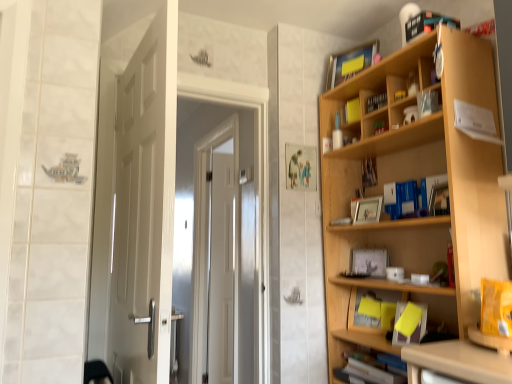
Question: Is the position of matte yellow book at upper right, the second book viewed from the top, less distant than that of yellow paper at lower right, the ninth book from the top?

Choices:
 (A) yes
 (B) no

Answer: (B)

Question: Is matte yellow book at upper right, positioned as the 9th book in bottom-to-top order, oriented towards yellow paper at lower right, which is the 2th book from bottom to top?

Choices:
 (A) no
 (B) yes

Answer: (A)

Question: Can you confirm if matte yellow book at upper right, positioned as the 9th book in bottom-to-top order, is smaller than yellow paper at lower right, the ninth book from the top?

Choices:
 (A) yes
 (B) no

Answer: (B)

Question: Is matte yellow book at upper right, the second book viewed from the top, further to the viewer compared to yellow paper at lower right, the ninth book from the top?

Choices:
 (A) yes
 (B) no

Answer: (A)

Question: From the image's perspective, does matte yellow book at upper right, the second book viewed from the top, appear lower than yellow paper at lower right, which is the 2th book from bottom to top?

Choices:
 (A) no
 (B) yes

Answer: (A)

Question: Does matte yellow book at upper right, the second book viewed from the top, appear on the left side of yellow paper at lower right, the ninth book from the top?

Choices:
 (A) yes
 (B) no

Answer: (A)

Question: Is matte plastic book at upper right, arranged as the fifth book when viewed from the top, bigger than black matte bookshelf at upper center, which is the eighth book from bottom to top?

Choices:
 (A) yes
 (B) no

Answer: (A)

Question: From a real-world perspective, is matte plastic book at upper right, arranged as the fifth book when viewed from the top, beneath black matte bookshelf at upper center, which is the eighth book from bottom to top?

Choices:
 (A) yes
 (B) no

Answer: (A)

Question: From the image's perspective, is matte plastic book at upper right, arranged as the fifth book when viewed from the top, on black matte bookshelf at upper center, the 3th book in the top-to-bottom sequence?

Choices:
 (A) no
 (B) yes

Answer: (A)

Question: Considering the relative sizes of matte plastic book at upper right, arranged as the fifth book when viewed from the top, and black matte bookshelf at upper center, which is the eighth book from bottom to top, in the image provided, is matte plastic book at upper right, arranged as the fifth book when viewed from the top, wider than black matte bookshelf at upper center, which is the eighth book from bottom to top,?

Choices:
 (A) yes
 (B) no

Answer: (A)

Question: Is the depth of matte plastic book at upper right, arranged as the fifth book when viewed from the top, less than that of black matte bookshelf at upper center, the 3th book in the top-to-bottom sequence?

Choices:
 (A) yes
 (B) no

Answer: (A)

Question: Can you confirm if matte plastic book at upper right, which appears as the sixth book when ordered from the bottom, is thinner than black matte bookshelf at upper center, which is the eighth book from bottom to top?

Choices:
 (A) no
 (B) yes

Answer: (A)

Question: From the image's perspective, is light wood bookcase at right on yellow paper at lower right, the ninth book from the top?

Choices:
 (A) no
 (B) yes

Answer: (B)